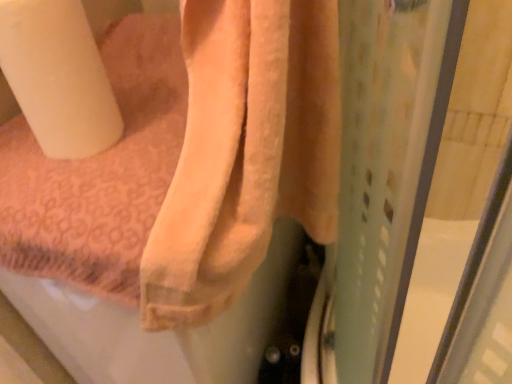
Question: Based on their positions, is orange terry towel at upper center located to the left or right of white matte toilet paper at left?

Choices:
 (A) right
 (B) left

Answer: (A)

Question: Considering the positions of orange terry towel at upper center and white matte toilet paper at left in the image, is orange terry towel at upper center wider or thinner than white matte toilet paper at left?

Choices:
 (A) thin
 (B) wide

Answer: (B)

Question: Considering the positions of orange terry towel at upper center and white matte toilet paper at left in the image, is orange terry towel at upper center taller or shorter than white matte toilet paper at left?

Choices:
 (A) short
 (B) tall

Answer: (B)

Question: In terms of width, does white matte toilet paper at left look wider or thinner when compared to orange terry towel at upper center?

Choices:
 (A) thin
 (B) wide

Answer: (A)

Question: Considering the positions of point click(54, 157) and point click(220, 238), is point click(54, 157) closer or farther from the camera than point click(220, 238)?

Choices:
 (A) closer
 (B) farther

Answer: (B)

Question: Do you think white matte toilet paper at left is within orange terry towel at upper center, or outside of it?

Choices:
 (A) outside
 (B) inside

Answer: (A)

Question: Considering their positions, is white matte toilet paper at left located in front of or behind orange terry towel at upper center?

Choices:
 (A) behind
 (B) front

Answer: (A)